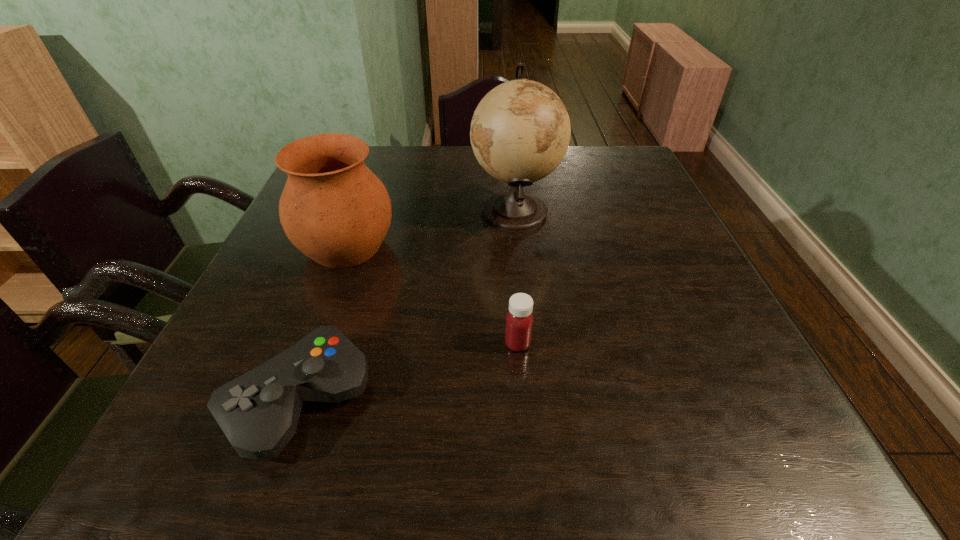
Where is `object present at the far edge`? The height and width of the screenshot is (540, 960). object present at the far edge is located at coordinates (520, 131).

You are a GUI agent. You are given a task and a screenshot of the screen. Output one action in this format:
    pyautogui.click(x=<x>, y=<y>)
    Task: Click on the object that is at the near edge
    This screenshot has width=960, height=540.
    Given the screenshot: What is the action you would take?
    pyautogui.click(x=258, y=412)

This screenshot has height=540, width=960. I want to click on pottery located at the left edge, so click(334, 209).

This screenshot has width=960, height=540. Find the location of `control present at the left edge`. control present at the left edge is located at coordinates click(x=258, y=412).

This screenshot has width=960, height=540. Find the location of `object at the near left corner`. object at the near left corner is located at coordinates (258, 412).

I want to click on vacant area at the far edge of the desktop, so click(x=577, y=181).

In the image, there is a desktop. Where is `vacant area at the near edge`? vacant area at the near edge is located at coordinates pyautogui.click(x=673, y=460).

You are a GUI agent. You are given a task and a screenshot of the screen. Output one action in this format:
    pyautogui.click(x=<x>, y=<y>)
    Task: Click on the free location at the left edge
    
    Given the screenshot: What is the action you would take?
    pyautogui.click(x=258, y=288)

You are a GUI agent. You are given a task and a screenshot of the screen. Output one action in this format:
    pyautogui.click(x=<x>, y=<y>)
    Task: Click on the vacant space at the right edge of the desktop
    Image resolution: width=960 pixels, height=540 pixels.
    Given the screenshot: What is the action you would take?
    pyautogui.click(x=696, y=266)

At what (x,y) coordinates should I click in order to perform the action: click on vacant point at the far right corner. Please return your answer as a coordinate pair (x, y). The width and height of the screenshot is (960, 540). Looking at the image, I should click on point(611,172).